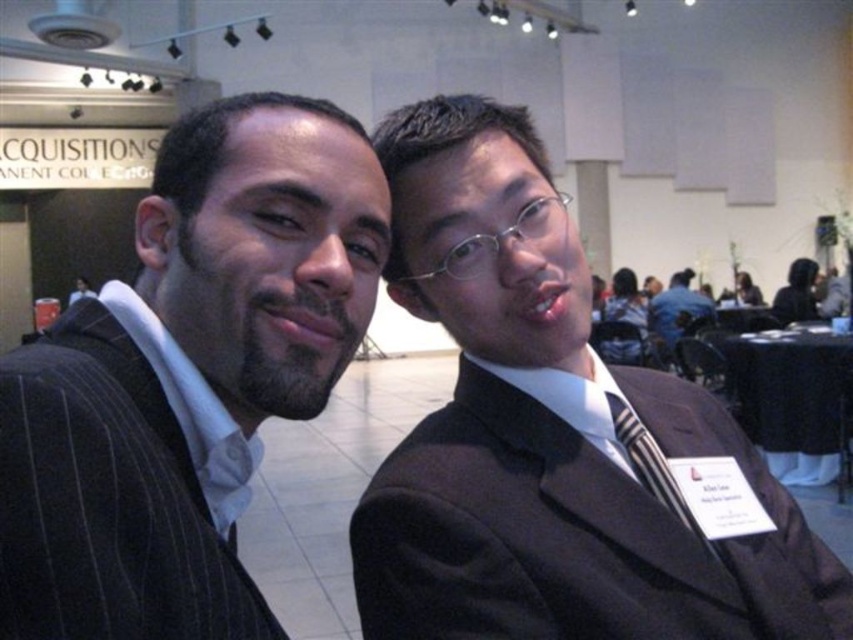
Question: Does dark brown pinstripe suit at center appear over pinstriped wool suit at left?

Choices:
 (A) yes
 (B) no

Answer: (B)

Question: Is the position of dark pinstripe suit at left less distant than that of pinstriped wool suit at left?

Choices:
 (A) yes
 (B) no

Answer: (B)

Question: Among these points, which one is farthest from the camera?

Choices:
 (A) (666, 461)
 (B) (525, 467)

Answer: (A)

Question: Can you confirm if dark brown pinstripe suit at center is positioned to the right of striped fabric tie at center?

Choices:
 (A) no
 (B) yes

Answer: (A)

Question: Which of the following is the farthest from the observer?

Choices:
 (A) (361, 285)
 (B) (659, 328)

Answer: (B)

Question: Which of the following is the closest to the observer?

Choices:
 (A) dark brown suit at center
 (B) pinstriped wool suit at left
 (C) dark pinstripe suit at left

Answer: (B)